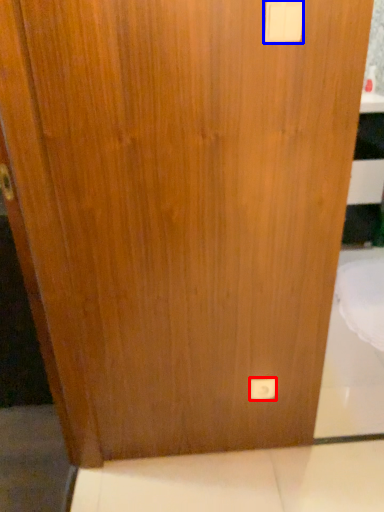
Question: Among these objects, which one is farthest to the camera, light switch (highlighted by a red box) or light switch (highlighted by a blue box)?

Choices:
 (A) light switch
 (B) light switch

Answer: (A)